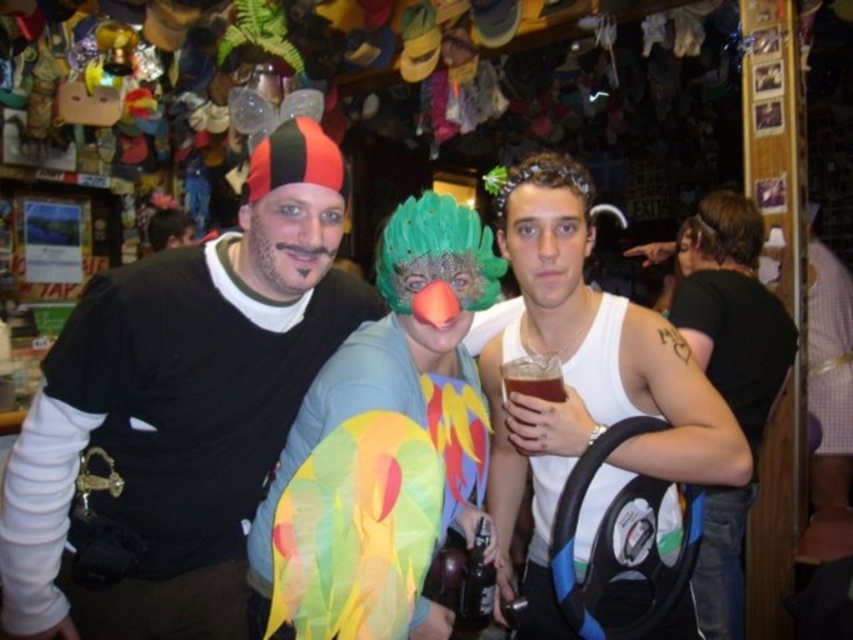
This screenshot has height=640, width=853. Describe the element at coordinates (585, 384) in the screenshot. I see `white tank top at center` at that location.

Is white tank top at center in front of multicolored fabric parrot at center?

No, white tank top at center is further to the viewer.

What are the coordinates of `white tank top at center` in the screenshot? It's located at (585, 384).

Between point (838, 403) and point (554, 394), which one is positioned in front?

Point (554, 394) is more forward.

Which is more to the right, brushed metal fork at upper right or brown glass beer at center?

brushed metal fork at upper right

The image size is (853, 640). What do you see at coordinates (828, 348) in the screenshot?
I see `brushed metal fork at upper right` at bounding box center [828, 348].

Identify the location of brushed metal fork at upper right. (828, 348).

Can you confirm if black matte shirt at center is thinner than multicolored fabric mask at center?

No, black matte shirt at center is not thinner than multicolored fabric mask at center.

Which is below, black matte shirt at center or multicolored fabric mask at center?

multicolored fabric mask at center

What do you see at coordinates (177, 413) in the screenshot?
I see `black matte shirt at center` at bounding box center [177, 413].

The width and height of the screenshot is (853, 640). Find the location of `black matte shirt at center`. black matte shirt at center is located at coordinates (177, 413).